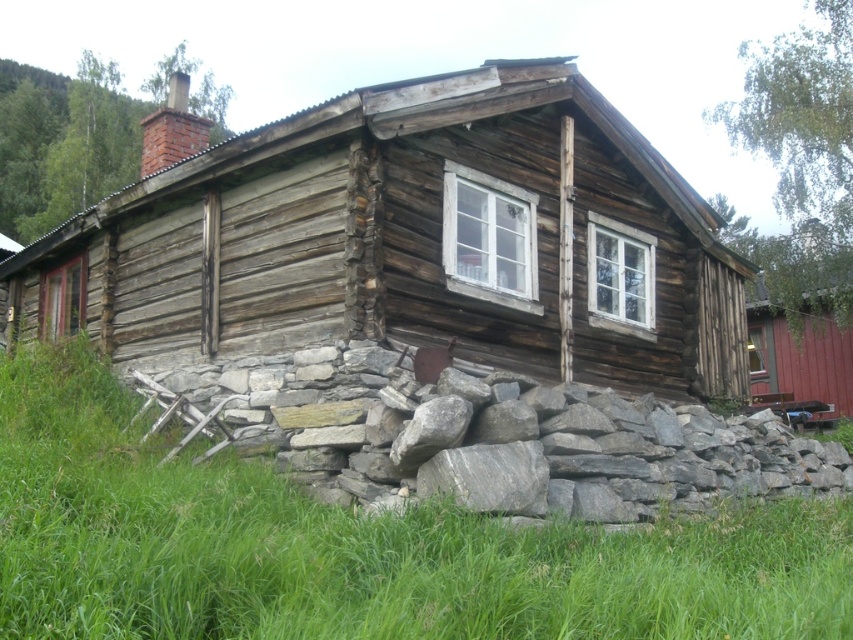
Question: Does weathered wood cabin at center have a lesser width compared to green grass at lower center?

Choices:
 (A) yes
 (B) no

Answer: (B)

Question: Which of the following is the farthest from the observer?

Choices:
 (A) (151, 225)
 (B) (30, 356)

Answer: (A)

Question: Is weathered wood cabin at center wider than green grass at lower center?

Choices:
 (A) yes
 (B) no

Answer: (A)

Question: Is weathered wood cabin at center smaller than green grass at lower center?

Choices:
 (A) no
 (B) yes

Answer: (A)

Question: Which point is closer to the camera taking this photo?

Choices:
 (A) (393, 540)
 (B) (260, 198)

Answer: (A)